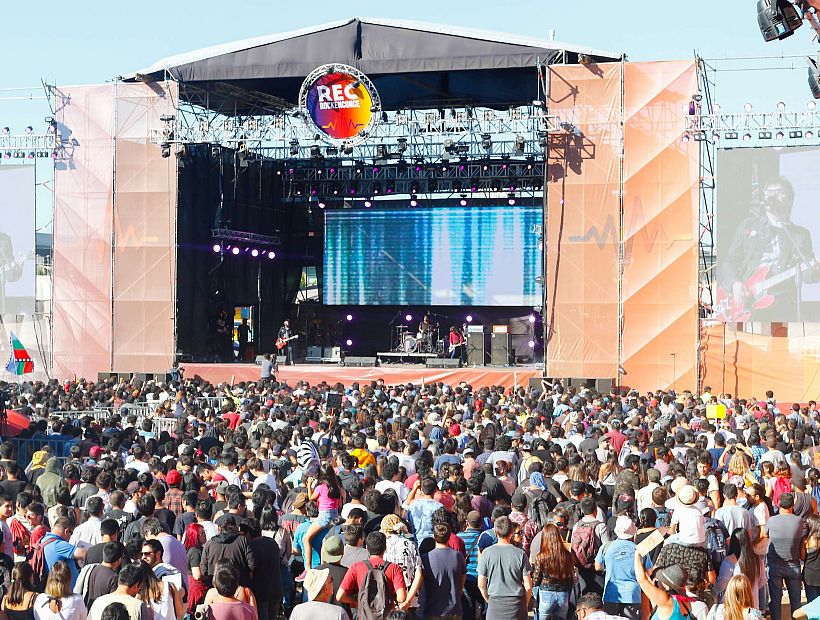
The image size is (820, 620). I want to click on stage, so click(422, 358), click(288, 358).